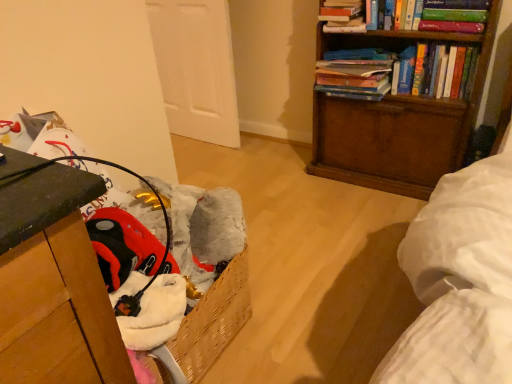
Question: Based on their positions, is wooden bookcase at upper right located to the left or right of hardcover books at upper right, the 2th book from the right?

Choices:
 (A) left
 (B) right

Answer: (B)

Question: Considering the positions of wooden bookcase at upper right and hardcover books at upper right, which ranks as the second book in left-to-right order, in the image, is wooden bookcase at upper right wider or thinner than hardcover books at upper right, which ranks as the second book in left-to-right order,?

Choices:
 (A) wide
 (B) thin

Answer: (B)

Question: Estimate the real-world distances between objects in this image. Which object is farther from the hardcover book at upper right, the 3th book from the right?

Choices:
 (A) hardcover books at upper right, the 1th book when ordered from right to left
 (B) hardcover books at upper right, which ranks as the second book in left-to-right order
 (C) wooden bookcase at upper right

Answer: (C)

Question: Based on their relative distances, which object is farther from the hardcover books at upper right, the 1th book when ordered from right to left?

Choices:
 (A) hardcover book at upper right, which is the 1th book from left to right
 (B) hardcover books at upper right, the 2th book from the right
 (C) wooden bookcase at upper right

Answer: (A)